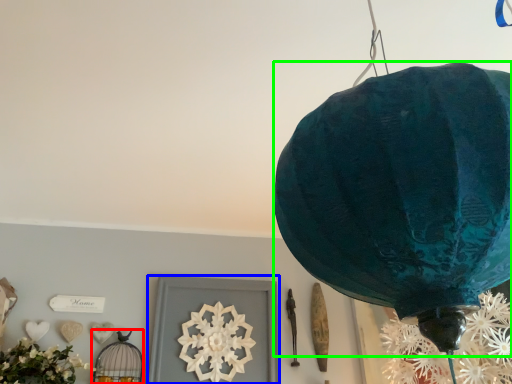
Question: Which object is positioned farthest from lamp (highlighted by a red box)? Select from picture frame (highlighted by a blue box) and lantern (highlighted by a green box).

Choices:
 (A) picture frame
 (B) lantern

Answer: (B)